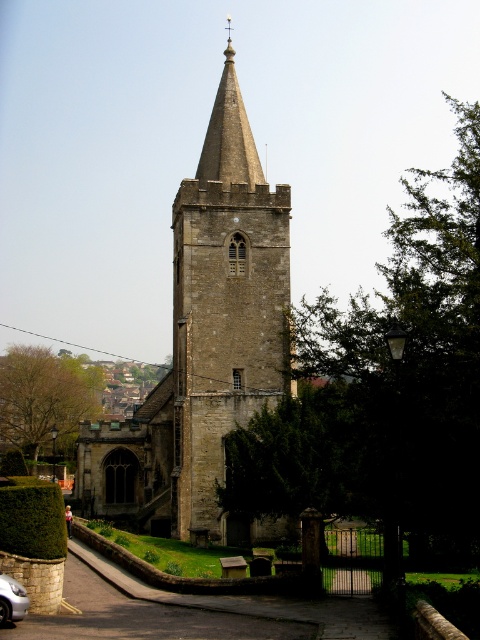
Is green leafy tree at center to the right of smooth stone spire at center from the viewer's perspective?

Indeed, green leafy tree at center is positioned on the right side of smooth stone spire at center.

Does point (276, 424) lie behind point (238, 179)?

No, (276, 424) is in front of (238, 179).

Locate an element on the screen. The height and width of the screenshot is (640, 480). green leafy tree at center is located at coordinates (387, 387).

Who is more forward, [464,170] or [41,372]?

Point [464,170] is more forward.

Is point (439, 433) positioned after point (59, 426)?

No, it is in front of (59, 426).

This screenshot has height=640, width=480. Find the location of `green leafy tree at center`. green leafy tree at center is located at coordinates (387, 387).

Locate an element on the screen. The width and height of the screenshot is (480, 640). green leafy tree at left is located at coordinates (46, 397).

Is green leafy tree at left shorter than silver metallic car at lower left?

No, green leafy tree at left is not shorter than silver metallic car at lower left.

Where is `green leafy tree at left`? green leafy tree at left is located at coordinates (46, 397).

This screenshot has height=640, width=480. I want to click on green leafy tree at left, so pyautogui.click(x=46, y=397).